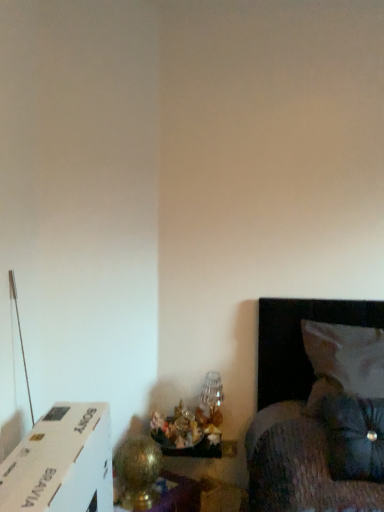
How much space does velvety black pillow at lower right, which is the 1th pillow from front to back, occupy horizontally?

velvety black pillow at lower right, which is the 1th pillow from front to back, is 23.29 centimeters wide.

Find the location of a particular element. The image size is (384, 512). white fabric pillow at right, which appears as the first pillow when viewed from the back is located at coordinates (347, 356).

Locate an element on the screen. This screenshot has width=384, height=512. velvety black pillow at lower right, which is the 1th pillow from front to back is located at coordinates (354, 436).

Does velvety black pillow at lower right, which is the 1th pillow from front to back, have a greater height compared to gold metallic table lamp at lower left, the 1th table lamp in the front-to-back sequence?

Indeed, velvety black pillow at lower right, which is the 1th pillow from front to back, has a greater height compared to gold metallic table lamp at lower left, the 1th table lamp in the front-to-back sequence.

Considering the positions of objects velvety black pillow at lower right, placed as the second pillow when sorted from back to front, and gold metallic table lamp at lower left, acting as the second table lamp starting from the right, in the image provided, who is more to the left, velvety black pillow at lower right, placed as the second pillow when sorted from back to front, or gold metallic table lamp at lower left, acting as the second table lamp starting from the right,?

From the viewer's perspective, gold metallic table lamp at lower left, acting as the second table lamp starting from the right, appears more on the left side.

Based on the photo, does velvety black pillow at lower right, placed as the second pillow when sorted from back to front, come in front of gold metallic table lamp at lower left, the 1th table lamp in the front-to-back sequence?

Yes, it is.

From the image's perspective, is velvety black pillow at lower right, placed as the second pillow when sorted from back to front, located above gold metallic table lamp at lower left, which is counted as the second table lamp, starting from the back?

Yes.

From a real-world perspective, is translucent glass vase at lower center, which ranks as the first table lamp in back-to-front order, above or below velvety black pillow at lower right, placed as the second pillow when sorted from back to front?

Clearly, from a real-world perspective, translucent glass vase at lower center, which ranks as the first table lamp in back-to-front order, is below velvety black pillow at lower right, placed as the second pillow when sorted from back to front.

Is translucent glass vase at lower center, the 2th table lamp viewed from the left, positioned with its back to velvety black pillow at lower right, which is the 1th pillow from front to back?

translucent glass vase at lower center, the 2th table lamp viewed from the left, does not have its back to velvety black pillow at lower right, which is the 1th pillow from front to back.

Which object is positioned more to the left, translucent glass vase at lower center, the 2th table lamp viewed from the left, or velvety black pillow at lower right, placed as the second pillow when sorted from back to front?

Positioned to the left is translucent glass vase at lower center, the 2th table lamp viewed from the left.

Can you tell me how much translucent glass vase at lower center, marked as the second table lamp in a front-to-back arrangement, and velvety black pillow at lower right, which is the 1th pillow from front to back, differ in facing direction?

1.36 degrees separate the facing orientations of translucent glass vase at lower center, marked as the second table lamp in a front-to-back arrangement, and velvety black pillow at lower right, which is the 1th pillow from front to back.

Can you tell me how much gold metallic table lamp at lower left, the 1th table lamp viewed from the left, and translucent glass vase at lower center, the first table lamp when ordered from right to left, differ in facing direction?

0.491 degrees separate the facing orientations of gold metallic table lamp at lower left, the 1th table lamp viewed from the left, and translucent glass vase at lower center, the first table lamp when ordered from right to left.

Who is taller, gold metallic table lamp at lower left, the 1th table lamp in the front-to-back sequence, or translucent glass vase at lower center, the first table lamp when ordered from right to left?

gold metallic table lamp at lower left, the 1th table lamp in the front-to-back sequence.

From a real-world perspective, is gold metallic table lamp at lower left, which is counted as the second table lamp, starting from the back, above or below translucent glass vase at lower center, the first table lamp when ordered from right to left?

gold metallic table lamp at lower left, which is counted as the second table lamp, starting from the back, is below translucent glass vase at lower center, the first table lamp when ordered from right to left.

Would you say gold metallic table lamp at lower left, the 1th table lamp viewed from the left, is a long distance from translucent glass vase at lower center, which ranks as the first table lamp in back-to-front order?

That's not correct — gold metallic table lamp at lower left, the 1th table lamp viewed from the left, is a little close to translucent glass vase at lower center, which ranks as the first table lamp in back-to-front order.

Is translucent glass vase at lower center, the 2th table lamp viewed from the left, thinner than gold metallic table lamp at lower left, which is counted as the second table lamp, starting from the back?

Yes.

From a real-world perspective, is translucent glass vase at lower center, the first table lamp when ordered from right to left, under gold metallic table lamp at lower left, acting as the second table lamp starting from the right?

No, from a real-world perspective, translucent glass vase at lower center, the first table lamp when ordered from right to left, is not beneath gold metallic table lamp at lower left, acting as the second table lamp starting from the right.

At what (x,y) coordinates should I click in order to perform the action: click on table lamp located above the gold metallic table lamp at lower left, acting as the second table lamp starting from the right (from a real-world perspective). Please return your answer as a coordinate pair (x, y). Looking at the image, I should click on (210, 400).

From the image's perspective, between translucent glass vase at lower center, marked as the second table lamp in a front-to-back arrangement, and gold metallic table lamp at lower left, acting as the second table lamp starting from the right, who is located below?

gold metallic table lamp at lower left, acting as the second table lamp starting from the right, from the image's perspective.

How far apart are white fabric pillow at right, the second pillow in the front-to-back sequence, and velvety black pillow at lower right, placed as the second pillow when sorted from back to front?

white fabric pillow at right, the second pillow in the front-to-back sequence, is 7.13 inches from velvety black pillow at lower right, placed as the second pillow when sorted from back to front.

Is white fabric pillow at right, the second pillow in the front-to-back sequence, oriented away from velvety black pillow at lower right, which is the 1th pillow from front to back?

No, white fabric pillow at right, the second pillow in the front-to-back sequence, is not facing the opposite direction of velvety black pillow at lower right, which is the 1th pillow from front to back.

Considering the relative sizes of white fabric pillow at right, which appears as the first pillow when viewed from the back, and velvety black pillow at lower right, which is the 1th pillow from front to back, in the image provided, is white fabric pillow at right, which appears as the first pillow when viewed from the back, taller than velvety black pillow at lower right, which is the 1th pillow from front to back,?

No.

Is white fabric pillow at right, which appears as the first pillow when viewed from the back, bigger than velvety black pillow at lower right, placed as the second pillow when sorted from back to front?

Correct, white fabric pillow at right, which appears as the first pillow when viewed from the back, is larger in size than velvety black pillow at lower right, placed as the second pillow when sorted from back to front.

Based on their sizes in the image, would you say velvety black pillow at lower right, which is the 1th pillow from front to back, is bigger or smaller than translucent glass vase at lower center, marked as the second table lamp in a front-to-back arrangement?

Clearly, velvety black pillow at lower right, which is the 1th pillow from front to back, is larger in size than translucent glass vase at lower center, marked as the second table lamp in a front-to-back arrangement.

Is velvety black pillow at lower right, placed as the second pillow when sorted from back to front, looking in the opposite direction of translucent glass vase at lower center, which ranks as the first table lamp in back-to-front order?

No.

Measure the distance from velvety black pillow at lower right, placed as the second pillow when sorted from back to front, to translucent glass vase at lower center, the first table lamp when ordered from right to left.

A distance of 24.30 inches exists between velvety black pillow at lower right, placed as the second pillow when sorted from back to front, and translucent glass vase at lower center, the first table lamp when ordered from right to left.

From the image's perspective, which is above, velvety black pillow at lower right, which is the 1th pillow from front to back, or translucent glass vase at lower center, the first table lamp when ordered from right to left?

velvety black pillow at lower right, which is the 1th pillow from front to back.

Is velvety black pillow at lower right, placed as the second pillow when sorted from back to front, wider than white fabric pillow at right, the second pillow in the front-to-back sequence?

No.

Is velvety black pillow at lower right, which is the 1th pillow from front to back, bigger or smaller than white fabric pillow at right, which appears as the first pillow when viewed from the back?

In the image, velvety black pillow at lower right, which is the 1th pillow from front to back, appears to be smaller than white fabric pillow at right, which appears as the first pillow when viewed from the back.

Measure the distance from velvety black pillow at lower right, placed as the second pillow when sorted from back to front, to white fabric pillow at right, the second pillow in the front-to-back sequence.

7.13 inches.

Locate an element on the screen. The image size is (384, 512). the 2nd table lamp below when counting from the velvety black pillow at lower right, which is the 1th pillow from front to back (from the image's perspective) is located at coordinates (138, 472).

Locate an element on the screen. This screenshot has width=384, height=512. the 1st table lamp to the left of the velvety black pillow at lower right, placed as the second pillow when sorted from back to front, starting your count from the anchor is located at coordinates (210, 400).

Which object lies nearer to the anchor point translucent glass vase at lower center, marked as the second table lamp in a front-to-back arrangement, velvety black pillow at lower right, placed as the second pillow when sorted from back to front, or white fabric pillow at right, the second pillow in the front-to-back sequence?

Based on the image, white fabric pillow at right, the second pillow in the front-to-back sequence, appears to be nearer to translucent glass vase at lower center, marked as the second table lamp in a front-to-back arrangement.

Which object lies nearer to the anchor point velvety black pillow at lower right, placed as the second pillow when sorted from back to front, gold metallic table lamp at lower left, acting as the second table lamp starting from the right, or translucent glass vase at lower center, the first table lamp when ordered from right to left?

Based on the image, translucent glass vase at lower center, the first table lamp when ordered from right to left, appears to be nearer to velvety black pillow at lower right, placed as the second pillow when sorted from back to front.

When comparing their distances from gold metallic table lamp at lower left, acting as the second table lamp starting from the right, does velvety black pillow at lower right, placed as the second pillow when sorted from back to front, or white fabric pillow at right, the second pillow in the front-to-back sequence, seem further?

white fabric pillow at right, the second pillow in the front-to-back sequence, is further to gold metallic table lamp at lower left, acting as the second table lamp starting from the right.

Which object lies nearer to the anchor point white fabric pillow at right, which appears as the first pillow when viewed from the back, translucent glass vase at lower center, the 2th table lamp viewed from the left, or gold metallic table lamp at lower left, which is counted as the second table lamp, starting from the back?

Among the two, translucent glass vase at lower center, the 2th table lamp viewed from the left, is located nearer to white fabric pillow at right, which appears as the first pillow when viewed from the back.

Based on their spatial positions, is translucent glass vase at lower center, the 2th table lamp viewed from the left, or velvety black pillow at lower right, placed as the second pillow when sorted from back to front, further from gold metallic table lamp at lower left, the 1th table lamp viewed from the left?

velvety black pillow at lower right, placed as the second pillow when sorted from back to front.

Estimate the real-world distances between objects in this image. Which object is further from translucent glass vase at lower center, the 2th table lamp viewed from the left, white fabric pillow at right, which appears as the first pillow when viewed from the back, or gold metallic table lamp at lower left, acting as the second table lamp starting from the right?

Based on the image, white fabric pillow at right, which appears as the first pillow when viewed from the back, appears to be further to translucent glass vase at lower center, the 2th table lamp viewed from the left.

Based on their spatial positions, is velvety black pillow at lower right, which is the 1th pillow from front to back, or gold metallic table lamp at lower left, the 1th table lamp in the front-to-back sequence, further from white fabric pillow at right, the second pillow in the front-to-back sequence?

gold metallic table lamp at lower left, the 1th table lamp in the front-to-back sequence, lies further to white fabric pillow at right, the second pillow in the front-to-back sequence, than the other object.

When comparing their distances from gold metallic table lamp at lower left, acting as the second table lamp starting from the right, does white fabric pillow at right, which appears as the first pillow when viewed from the back, or velvety black pillow at lower right, which is the 1th pillow from front to back, seem further?

white fabric pillow at right, which appears as the first pillow when viewed from the back, lies further to gold metallic table lamp at lower left, acting as the second table lamp starting from the right, than the other object.

Identify the location of table lamp between gold metallic table lamp at lower left, the 1th table lamp in the front-to-back sequence, and white fabric pillow at right, which appears as the first pillow when viewed from the back, from left to right. (210, 400).

You are a GUI agent. You are given a task and a screenshot of the screen. Output one action in this format:
    pyautogui.click(x=<x>, y=<y>)
    Task: Click on the pillow between translucent glass vase at lower center, the 2th table lamp viewed from the left, and white fabric pillow at right, which appears as the first pillow when viewed from the back, in the horizontal direction
    The height and width of the screenshot is (512, 384).
    Given the screenshot: What is the action you would take?
    pyautogui.click(x=354, y=436)

What are the coordinates of `pillow located between gold metallic table lamp at lower left, which is counted as the second table lamp, starting from the back, and white fabric pillow at right, which appears as the first pillow when viewed from the back, in the left-right direction` in the screenshot? It's located at (354, 436).

You are a GUI agent. You are given a task and a screenshot of the screen. Output one action in this format:
    pyautogui.click(x=<x>, y=<y>)
    Task: Click on the table lamp between gold metallic table lamp at lower left, the 1th table lamp in the front-to-back sequence, and velvety black pillow at lower right, placed as the second pillow when sorted from back to front
    
    Given the screenshot: What is the action you would take?
    [210, 400]